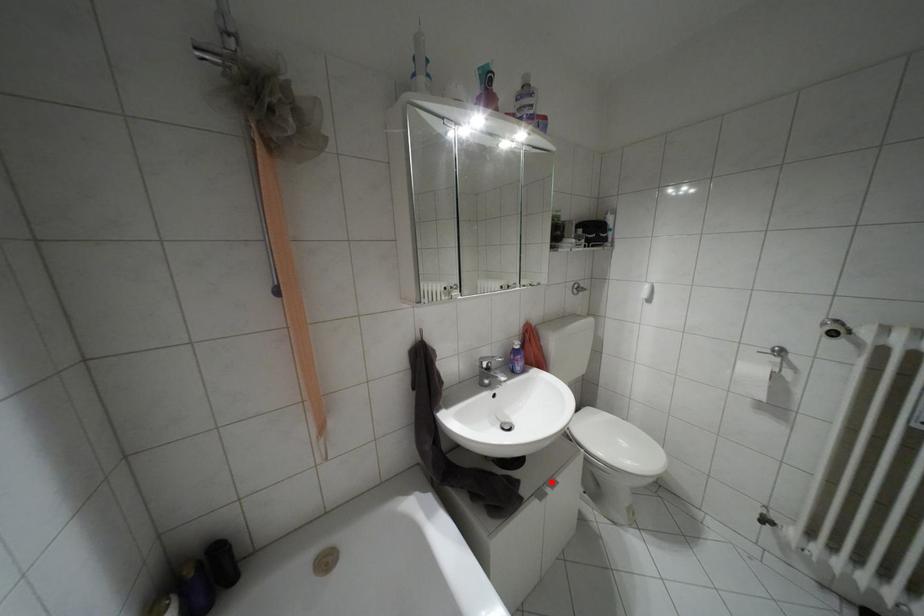
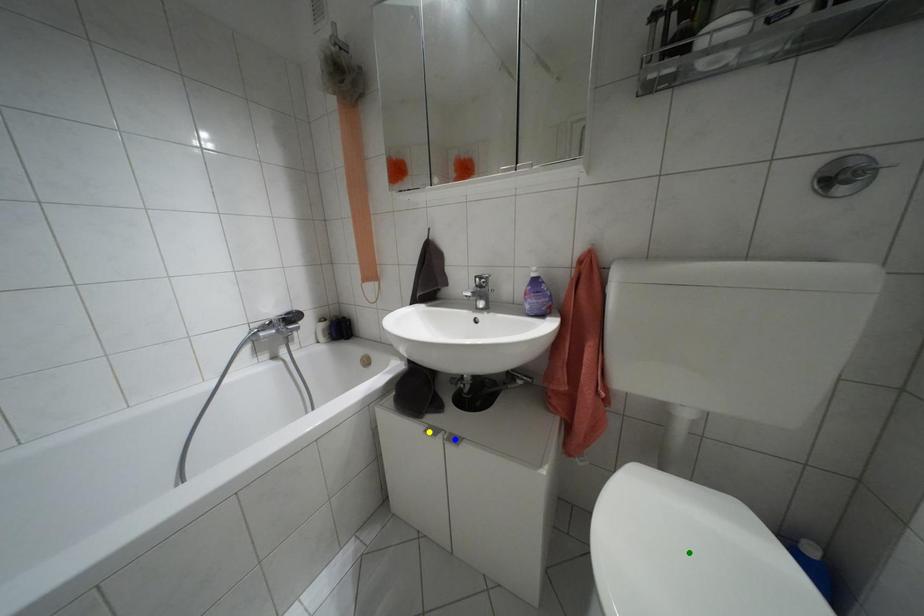
Question: I am providing you with two images of the same scene from different viewpoints. A red point is marked on the first image. You are given multiple points on the second image. Which point in image 2 represents the same 3d spot as the red point in image 1?

Choices:
 (A) blue point
 (B) yellow point
 (C) green point

Answer: (A)